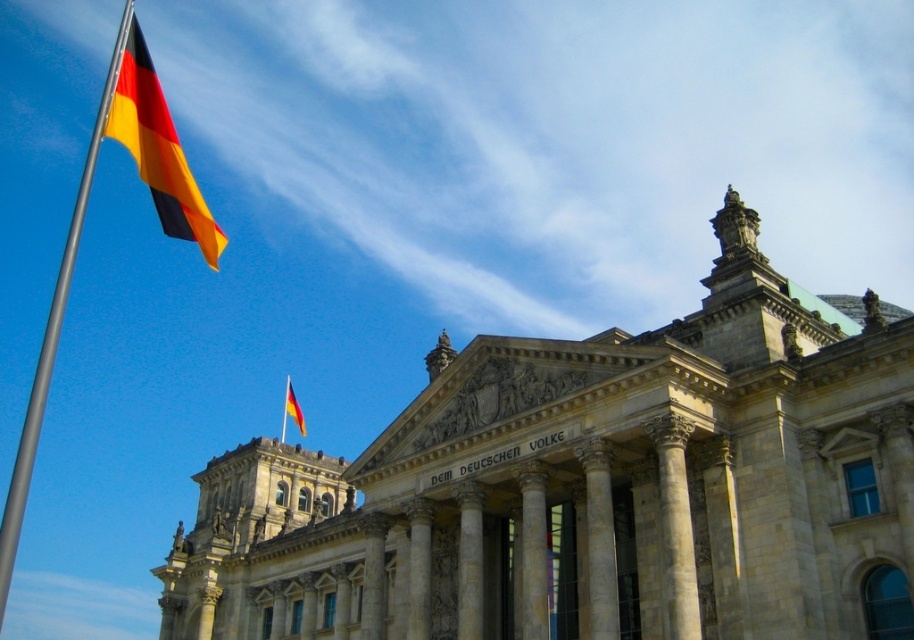
You are standing in front of the building and notice two metallic poles. One is the metallic pole at left and the other is the polished metal flag pole at upper left. Which pole is larger in size?

The metallic pole at left is bigger than the polished metal flag pole at upper left, so the metallic pole at left is larger in size.

You are a photographer planning to capture the grand building with both flags in the frame. Which flag, the polished fabric flag at upper left or the matte fabric flag at upper left, will appear taller in your photo?

The polished fabric flag at upper left will appear taller in the photo because it has a greater height compared to the matte fabric flag at upper left.

You are a photographer planning to capture the grand structure with both the polished fabric flag at upper left and the matte fabric flag at upper left in the frame. Which flag has a wider width that might occupy more space in your photo?

The polished fabric flag at upper left has a larger width than the matte fabric flag at upper left, so it will occupy more space in the photo.